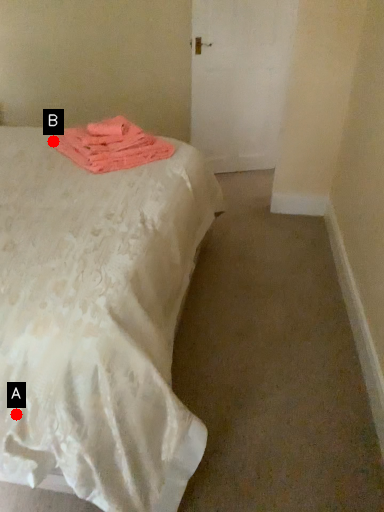
Question: Two points are circled on the image, labeled by A and B beside each circle. Which point is closer to the camera?

Choices:
 (A) A is closer
 (B) B is closer

Answer: (A)